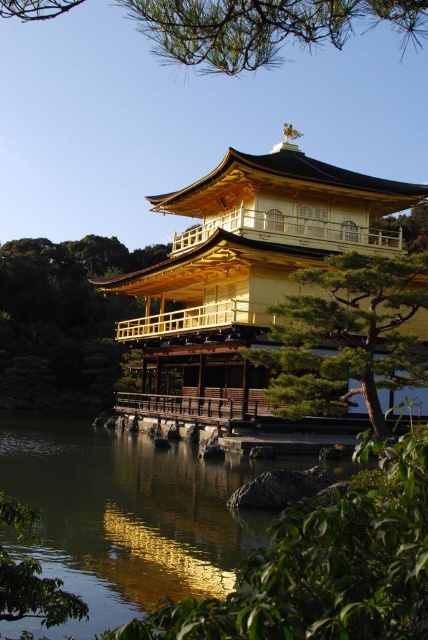
Is green pine branches at upper center thinner than green leafy tree at lower left?

No.

Measure the distance between point [395,3] and camera.

Point [395,3] and camera are 27.15 meters apart from each other.

Locate an element on the screen. green pine branches at upper center is located at coordinates (262, 28).

Is green textured pine tree at center to the left of green pine branches at upper center from the viewer's perspective?

Incorrect, green textured pine tree at center is not on the left side of green pine branches at upper center.

Can you confirm if green textured pine tree at center is positioned above green pine branches at upper center?

No, green textured pine tree at center is not above green pine branches at upper center.

Does point (356, 292) lie behind point (311, 22)?

Yes.

Image resolution: width=428 pixels, height=640 pixels. I want to click on green textured pine tree at center, so click(x=347, y=337).

Between golden polished wood pagoda at center and green pine branches at upper center, which one is positioned higher?

green pine branches at upper center is above.

Which of these two, golden polished wood pagoda at center or green pine branches at upper center, stands shorter?

Standing shorter between the two is golden polished wood pagoda at center.

At what (x,y) coordinates should I click in order to perform the action: click on golden polished wood pagoda at center. Please return your answer as a coordinate pair (x, y). Image resolution: width=428 pixels, height=640 pixels. Looking at the image, I should click on (246, 266).

Find the location of a particular element. The height and width of the screenshot is (640, 428). golden polished wood pagoda at center is located at coordinates (246, 266).